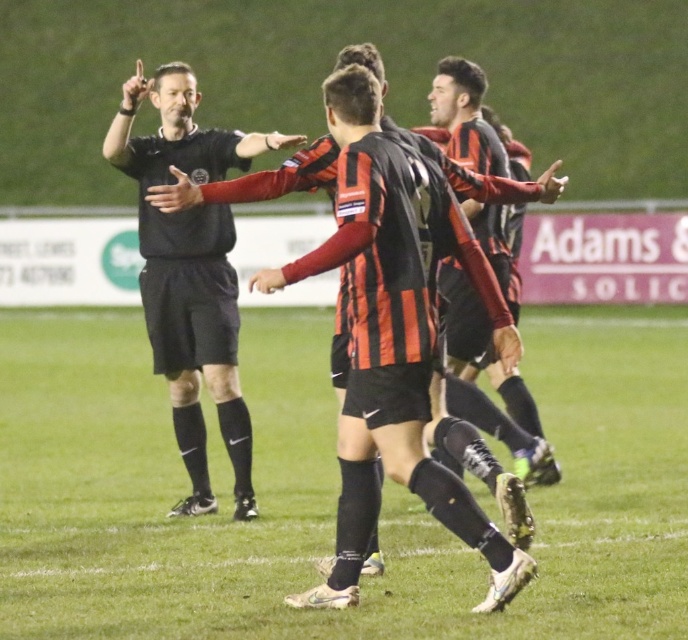
Question: Observing the image, what is the correct spatial positioning of green grass at center in reference to black and orange striped jersey at center?

Choices:
 (A) right
 (B) left

Answer: (B)

Question: Which point appears closest to the camera in this image?

Choices:
 (A) (416, 433)
 (B) (449, 97)

Answer: (A)

Question: Among these points, which one is farthest from the camera?

Choices:
 (A) tap(442, 90)
 (B) tap(376, 483)

Answer: (A)

Question: In this image, where is black matte referee at center located relative to black and orange striped jersey at center?

Choices:
 (A) above
 (B) below

Answer: (B)

Question: Is black matte referee at center below black and orange striped jersey at center?

Choices:
 (A) no
 (B) yes

Answer: (B)

Question: Which object is farther from the camera taking this photo?

Choices:
 (A) green grass at center
 (B) black striped jersey at center

Answer: (A)